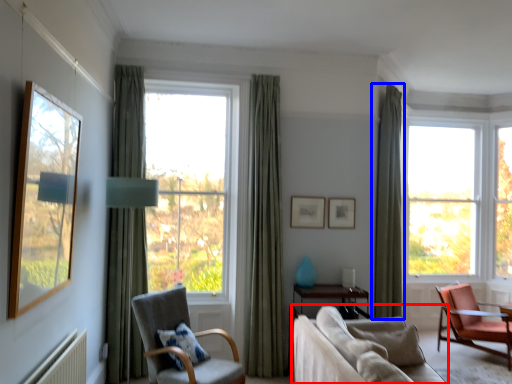
Question: Which object appears closest to the camera in this image, studio couch (highlighted by a red box) or curtain (highlighted by a blue box)?

Choices:
 (A) studio couch
 (B) curtain

Answer: (A)